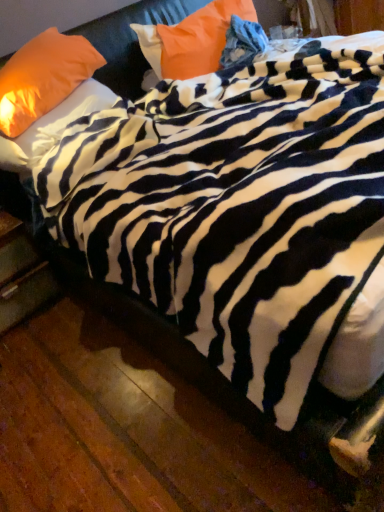
Question: Looking at the image, does wooden drawer at lower left seem bigger or smaller compared to orange fabric pillow at upper left, which is counted as the third pillow, starting from the right?

Choices:
 (A) big
 (B) small

Answer: (A)

Question: Is point (19, 311) closer or farther from the camera than point (36, 56)?

Choices:
 (A) farther
 (B) closer

Answer: (A)

Question: Which object is positioned closest to the orange fabric pillow at upper center, marked as the third pillow in a left-to-right arrangement?

Choices:
 (A) matte orange pillow at upper left, which is the 2th pillow from right to left
 (B) wooden drawer at lower left
 (C) orange fabric pillow at upper left, which is counted as the third pillow, starting from the right

Answer: (C)

Question: Considering the real-world distances, which object is closest to the orange fabric pillow at upper center, marked as the third pillow in a left-to-right arrangement?

Choices:
 (A) wooden drawer at lower left
 (B) matte orange pillow at upper left, marked as the second pillow in a left-to-right arrangement
 (C) orange fabric pillow at upper left, which is counted as the third pillow, starting from the right

Answer: (C)